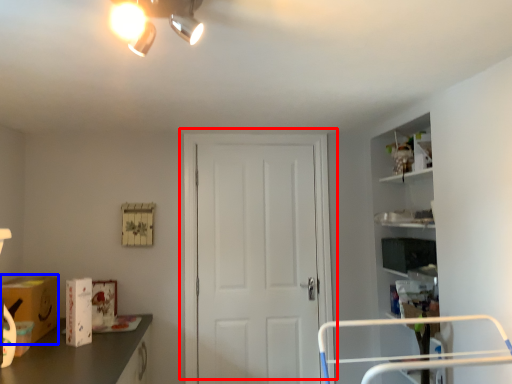
Question: Which object is closer to the camera taking this photo, door (highlighted by a red box) or cardboard box (highlighted by a blue box)?

Choices:
 (A) door
 (B) cardboard box

Answer: (B)